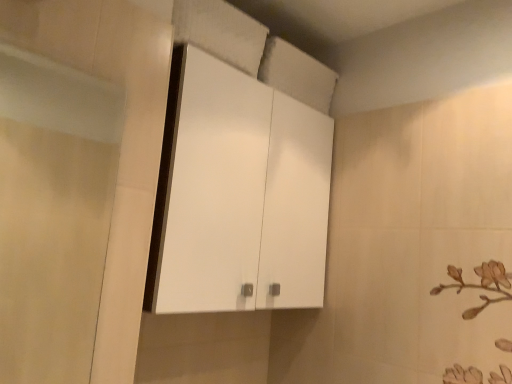
Question: Is white glossy cabinet at upper center taller or shorter than transparent glass screen door at left?

Choices:
 (A) tall
 (B) short

Answer: (A)

Question: Considering the positions of point (201, 163) and point (101, 130), is point (201, 163) closer or farther from the camera than point (101, 130)?

Choices:
 (A) farther
 (B) closer

Answer: (B)

Question: From a real-world perspective, is white glossy cabinet at upper center positioned above or below transparent glass screen door at left?

Choices:
 (A) below
 (B) above

Answer: (B)

Question: Does point (65, 170) appear closer or farther from the camera than point (308, 165)?

Choices:
 (A) farther
 (B) closer

Answer: (A)

Question: From the image's perspective, relative to white glossy cabinet at upper center, is transparent glass screen door at left above or below?

Choices:
 (A) above
 (B) below

Answer: (B)

Question: Do you think transparent glass screen door at left is within white glossy cabinet at upper center, or outside of it?

Choices:
 (A) outside
 (B) inside

Answer: (A)

Question: In terms of height, does transparent glass screen door at left look taller or shorter compared to white glossy cabinet at upper center?

Choices:
 (A) short
 (B) tall

Answer: (A)